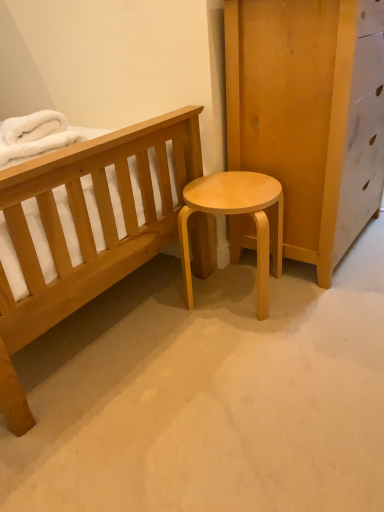
Question: From the image's perspective, is light wood/matte stool at center positioned above or below white fluffy blanket at upper left?

Choices:
 (A) above
 (B) below

Answer: (B)

Question: In terms of height, does light wood/matte stool at center look taller or shorter compared to white fluffy blanket at upper left?

Choices:
 (A) short
 (B) tall

Answer: (B)

Question: Considering their positions, is light wood/matte stool at center located in front of or behind white fluffy blanket at upper left?

Choices:
 (A) front
 (B) behind

Answer: (B)

Question: In the image, is white fluffy blanket at upper left on the left side or the right side of light wood/matte stool at center?

Choices:
 (A) left
 (B) right

Answer: (A)

Question: From a real-world perspective, is white fluffy blanket at upper left above or below light wood/matte stool at center?

Choices:
 (A) below
 (B) above

Answer: (B)

Question: Is point (36, 122) closer or farther from the camera than point (279, 242)?

Choices:
 (A) farther
 (B) closer

Answer: (B)

Question: Looking at the image, does white fluffy blanket at upper left seem bigger or smaller compared to light wood/matte stool at center?

Choices:
 (A) big
 (B) small

Answer: (B)